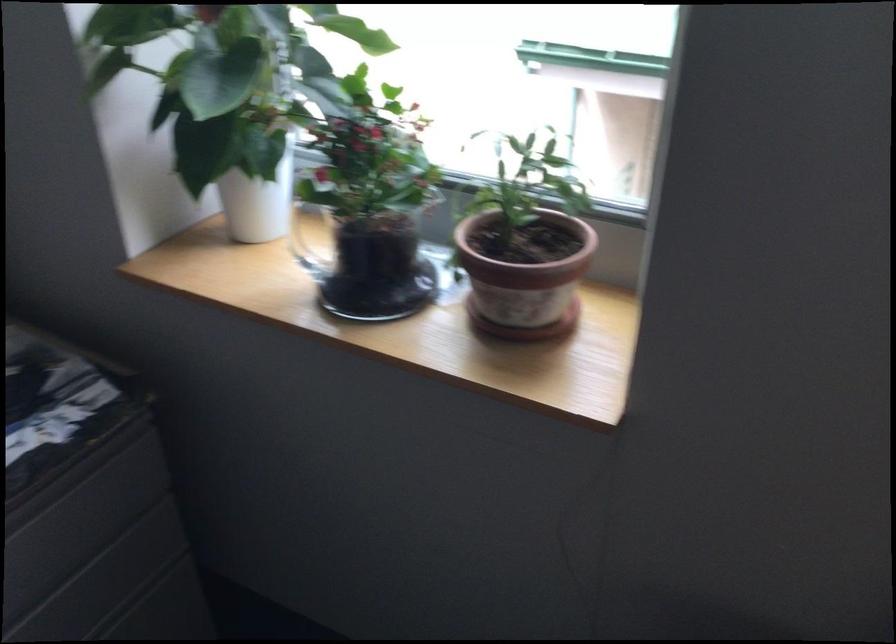
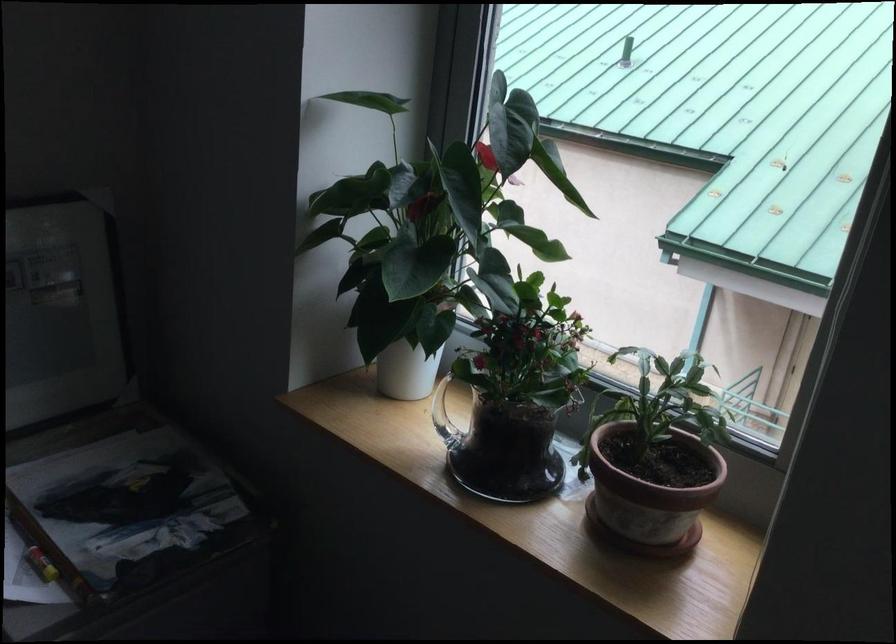
Locate, in the second image, the point that corresponds to (x=520, y=275) in the first image.

(650, 493)